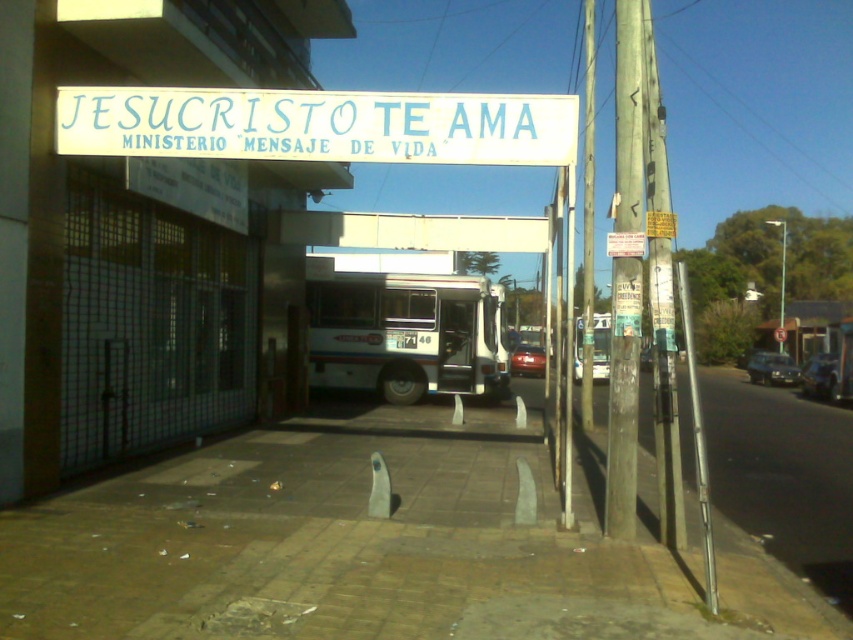
Is white plastic bus stop at center wider than metallic silver sedan at center?

Correct, the width of white plastic bus stop at center exceeds that of metallic silver sedan at center.

Is point (268, 154) positioned in front of point (750, 364)?

Yes, point (268, 154) is in front of point (750, 364).

This screenshot has width=853, height=640. Identify the location of white plastic bus stop at center. click(x=320, y=125).

Looking at this image, is white plastic bus stop at center closer to camera compared to shiny red car at center?

Yes, it is.

In the scene shown: Is the position of white plastic bus stop at center more distant than that of shiny red car at center?

No, white plastic bus stop at center is closer to the viewer.

Is point (343, 134) farther from viewer compared to point (521, 356)?

No, it is not.

This screenshot has height=640, width=853. Find the location of `white plastic bus stop at center`. white plastic bus stop at center is located at coordinates (320, 125).

Can you confirm if white matte bus at center is smaller than metallic silver sedan at center?

Indeed, white matte bus at center has a smaller size compared to metallic silver sedan at center.

Can you confirm if white matte bus at center is thinner than metallic silver sedan at center?

Indeed, white matte bus at center has a lesser width compared to metallic silver sedan at center.

Which is behind, point (323, 298) or point (787, 381)?

Point (787, 381)

The height and width of the screenshot is (640, 853). Identify the location of white matte bus at center. (405, 333).